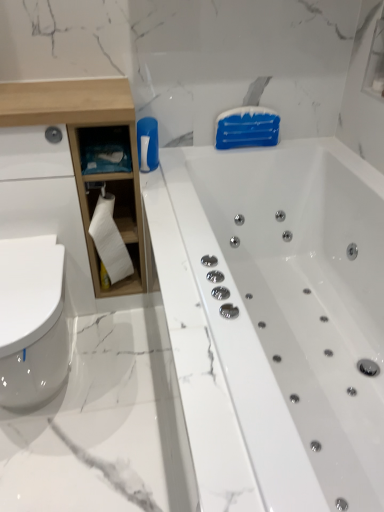
The height and width of the screenshot is (512, 384). I want to click on unoccupied region to the right of white glossy toilet at lower left, so click(128, 389).